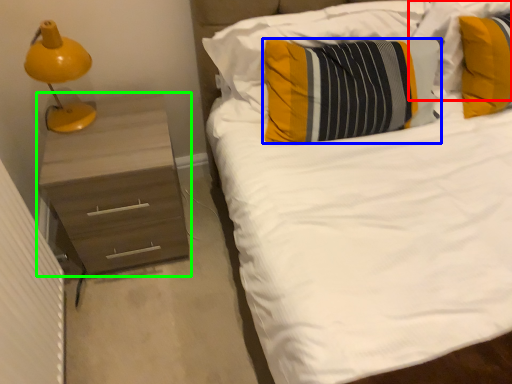
Question: Considering the real-world distances, which object is farthest from pillow (highlighted by a red box)? pillow (highlighted by a blue box) or chest of drawers (highlighted by a green box)?

Choices:
 (A) pillow
 (B) chest of drawers

Answer: (B)